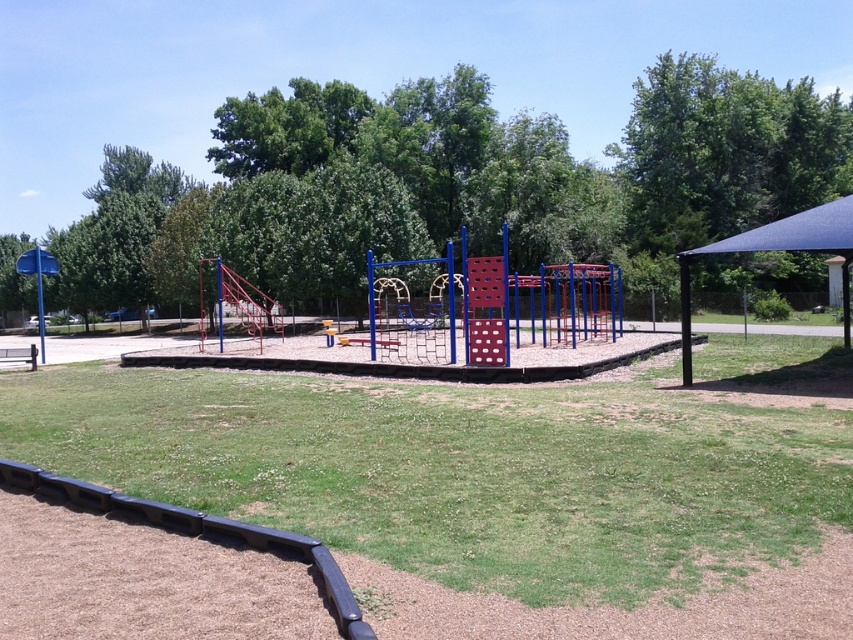
Is point (622, 493) closer to viewer compared to point (270, 93)?

Yes, point (622, 493) is closer to viewer.

Image resolution: width=853 pixels, height=640 pixels. Find the location of `green grass at center`. green grass at center is located at coordinates (460, 468).

This screenshot has width=853, height=640. I want to click on green grass at center, so click(x=460, y=468).

Is green grass at center below blue fabric canopy at right?

Yes.

Between point (383, 448) and point (804, 212), which one is positioned in front?

Positioned in front is point (383, 448).

Identify the location of green grass at center. The height and width of the screenshot is (640, 853). (460, 468).

Can you confirm if green leafy tree at center is wider than blue fabric canopy at right?

Correct, the width of green leafy tree at center exceeds that of blue fabric canopy at right.

Does green leafy tree at center have a greater height compared to blue fabric canopy at right?

Correct, green leafy tree at center is much taller as blue fabric canopy at right.

Who is more distant from viewer, (241, 237) or (817, 228)?

The point (241, 237) is more distant.

You are a GUI agent. You are given a task and a screenshot of the screen. Output one action in this format:
    pyautogui.click(x=<x>, y=<y>)
    Task: Click on the green leafy tree at center
    This screenshot has height=640, width=853.
    Given the screenshot: What is the action you would take?
    pyautogui.click(x=451, y=184)